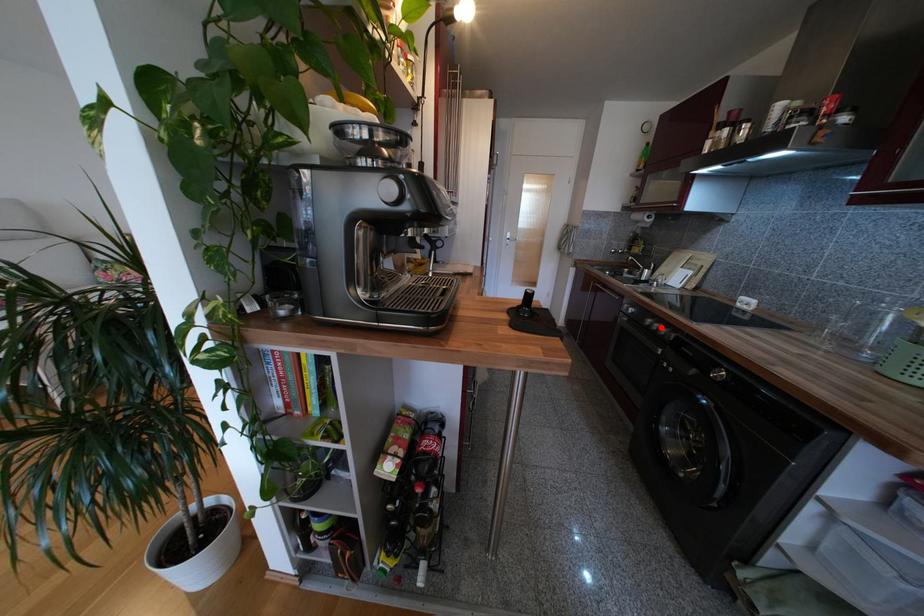
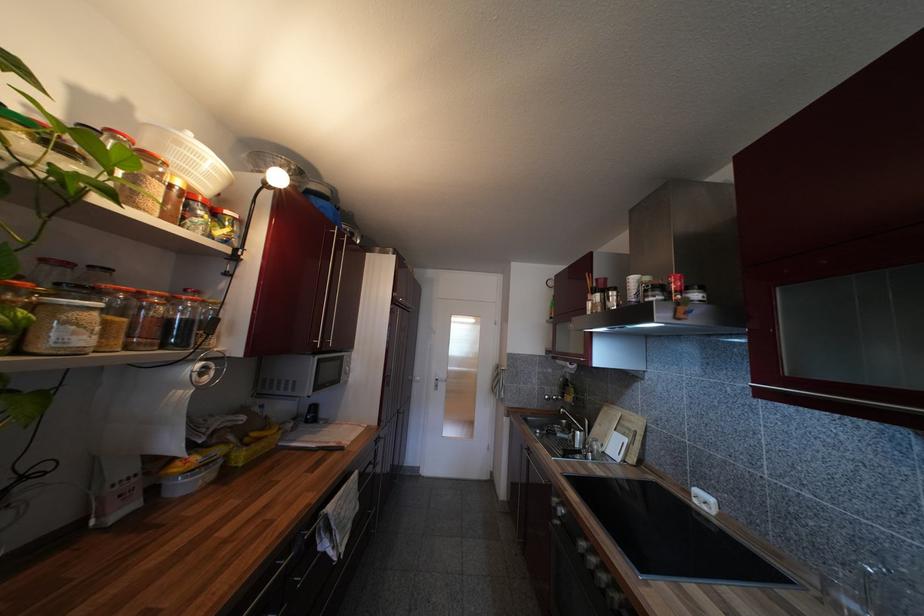
Question: I am providing you with two images of the same scene from different viewpoints. A red point is marked on the first image. Can you still see the location of the red point in image 2?

Choices:
 (A) Yes
 (B) No

Answer: (A)